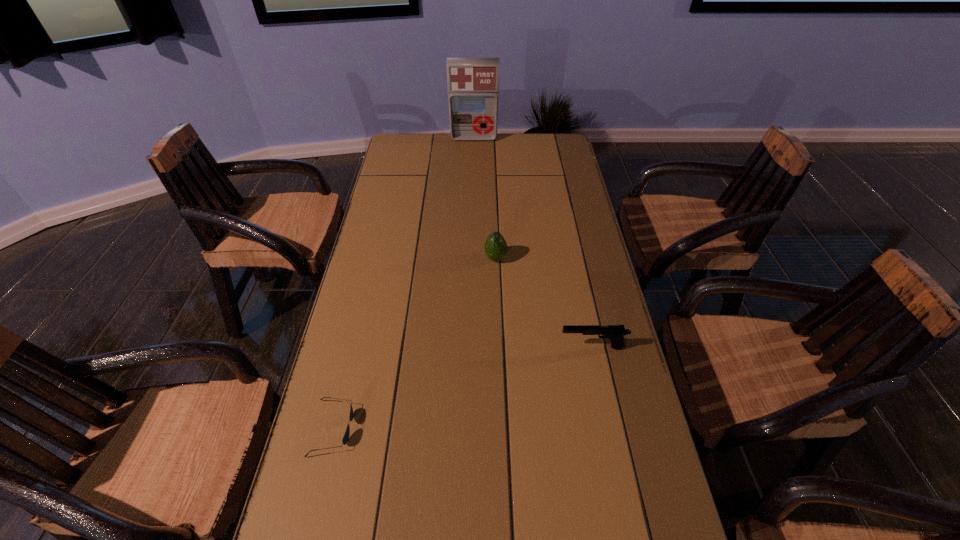
What are the coordinates of `free space between the leftmost object and the farthest object` in the screenshot? It's located at (403, 283).

I want to click on object that is the third closest to the first-aid kit, so click(345, 439).

Locate an element on the screen. This screenshot has width=960, height=540. object that is the second closest to the leftmost object is located at coordinates (495, 248).

I want to click on vacant space that satisfies the following two spatial constraints: 1. on the front-facing side of the avocado; 2. on the left side of the tallest object, so click(471, 258).

The width and height of the screenshot is (960, 540). I want to click on vacant space that satisfies the following two spatial constraints: 1. on the front-facing side of the first-aid kit; 2. on the left side of the third nearest object, so click(471, 258).

Image resolution: width=960 pixels, height=540 pixels. I want to click on vacant area in the image that satisfies the following two spatial constraints: 1. on the front-facing side of the first-aid kit; 2. on the lenses of the leftmost object, so click(468, 428).